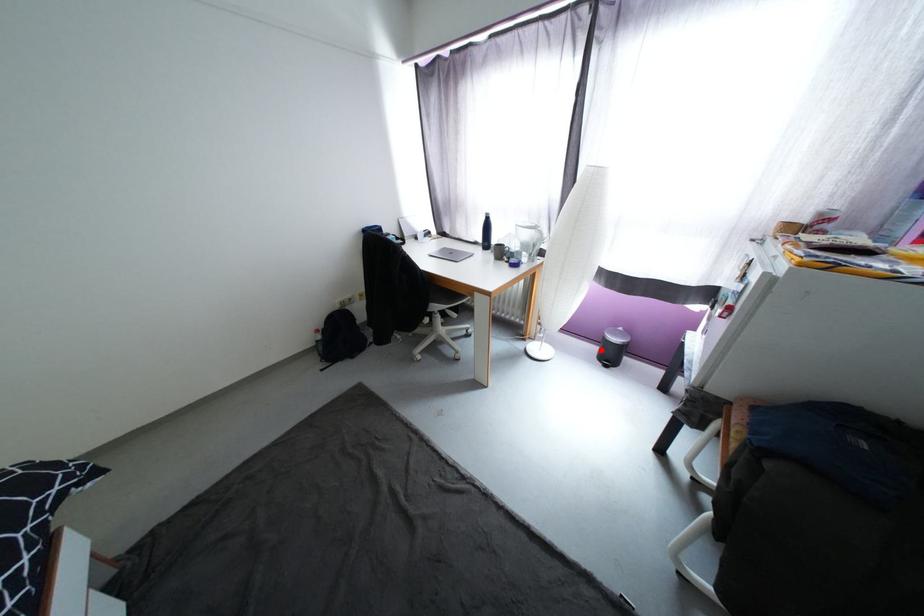
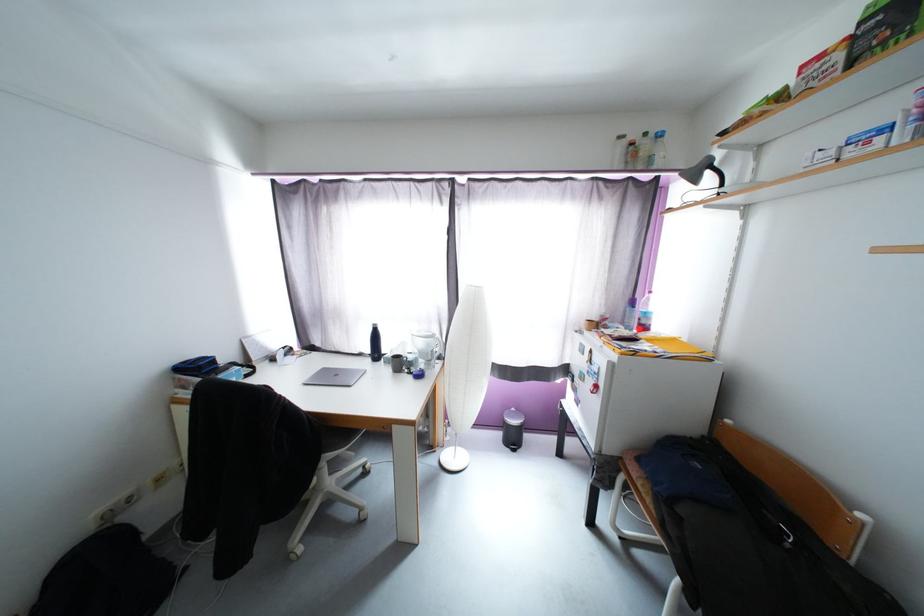
Question: I am providing you with two images of the same scene from different viewpoints. Given a red point in image1, look at the same physical point in image2. Is it:

Choices:
 (A) Closer to the viewpoint
 (B) Farther from the viewpoint

Answer: (A)